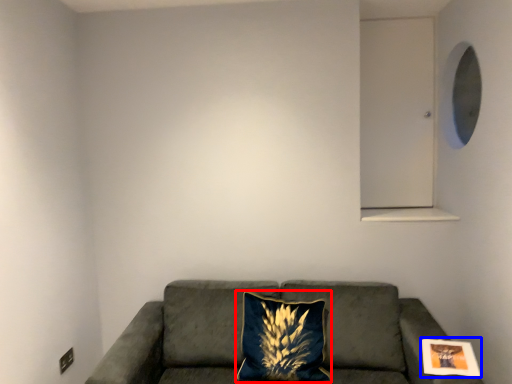
Question: Which of the following is the closest to the observer, pillow (highlighted by a red box) or picture frame (highlighted by a blue box)?

Choices:
 (A) pillow
 (B) picture frame

Answer: (B)